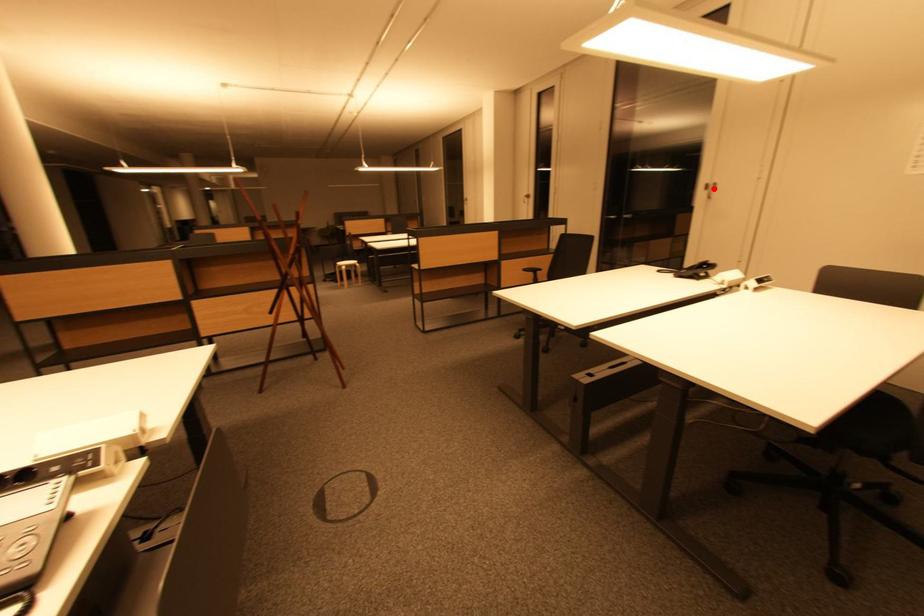
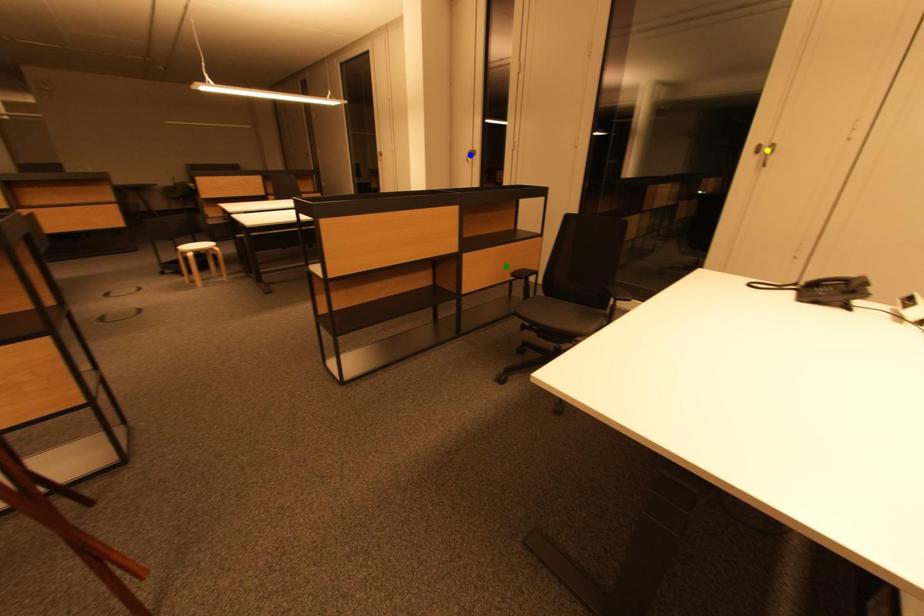
Question: I am providing you with two images of the same scene from different viewpoints. A red point is marked on the first image. You are given multiple points on the second image. Which mark in image 2 goes with the point in image 1?

Choices:
 (A) blue point
 (B) green point
 (C) yellow point

Answer: (C)